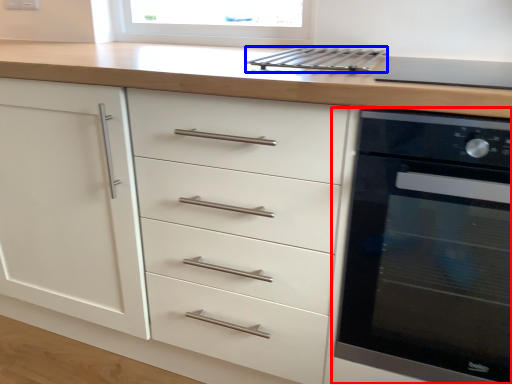
Question: Which of the following is the farthest to the observer, home appliance (highlighted by a red box) or kitchen appliance (highlighted by a blue box)?

Choices:
 (A) home appliance
 (B) kitchen appliance

Answer: (B)